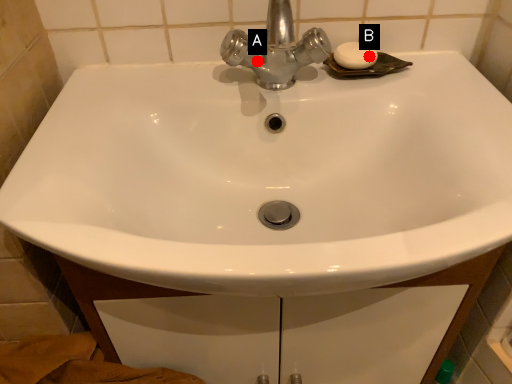
Question: Two points are circled on the image, labeled by A and B beside each circle. Which point is farther to the camera?

Choices:
 (A) A is further
 (B) B is further

Answer: (B)